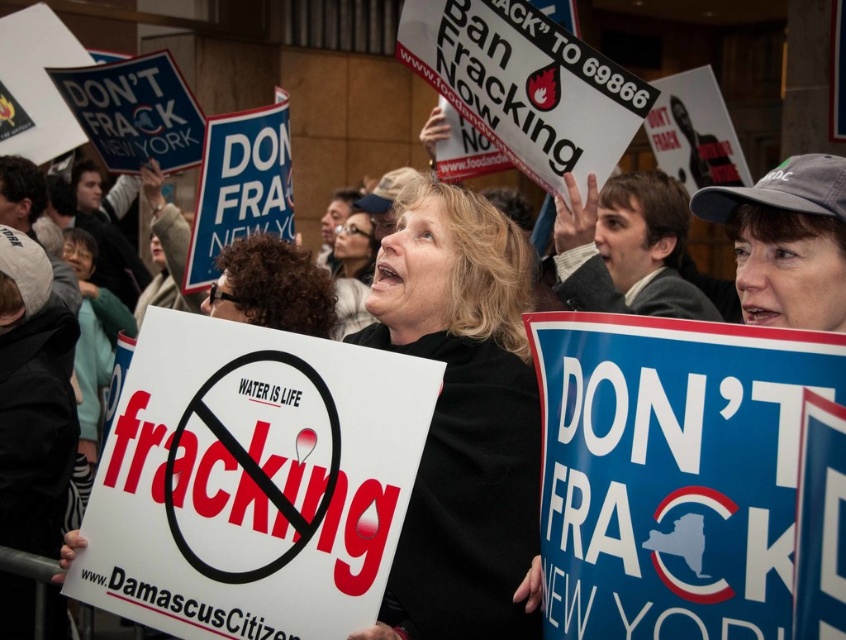
Question: Can you confirm if blue paper sign at center is wider than black matte sign at center?

Choices:
 (A) yes
 (B) no

Answer: (A)

Question: Does blue paper sign at center appear over black matte sign at center?

Choices:
 (A) no
 (B) yes

Answer: (B)

Question: Can you confirm if blue paper sign at center is smaller than black matte sign at center?

Choices:
 (A) no
 (B) yes

Answer: (A)

Question: Which point is closer to the camera taking this photo?

Choices:
 (A) (792, 433)
 (B) (503, 282)

Answer: (A)